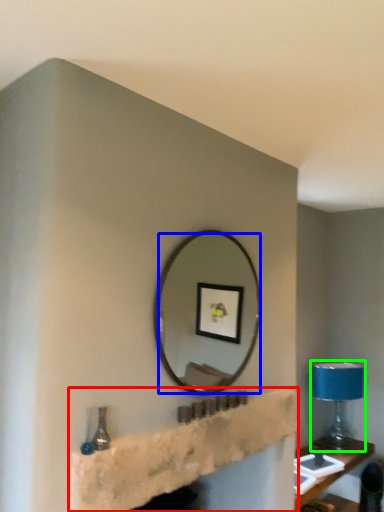
Question: Considering the real-world distances, which object is closest to shelf (highlighted by a red box)? mirror (highlighted by a blue box) or table lamp (highlighted by a green box).

Choices:
 (A) mirror
 (B) table lamp

Answer: (B)